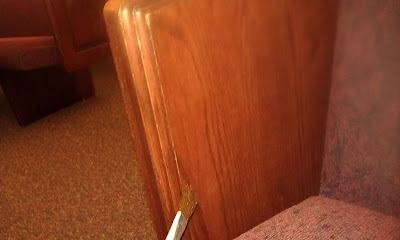
At what (x,y) coordinates should I click in order to perform the action: click on wooden panel. Please return your answer as a coordinate pair (x, y). Image resolution: width=400 pixels, height=240 pixels. Looking at the image, I should click on (234, 131).